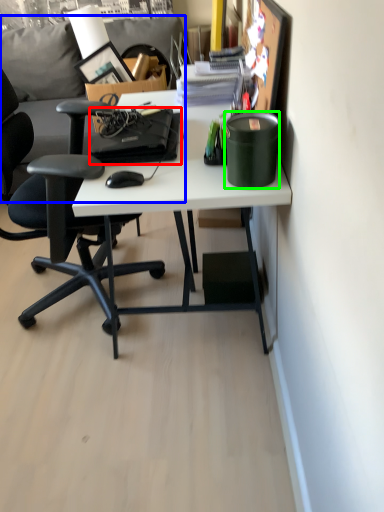
Question: Estimate the real-world distances between objects in this image. Which object is closer to laptop (highlighted by a red box), couch (highlighted by a blue box) or stationery (highlighted by a green box)?

Choices:
 (A) couch
 (B) stationery

Answer: (B)